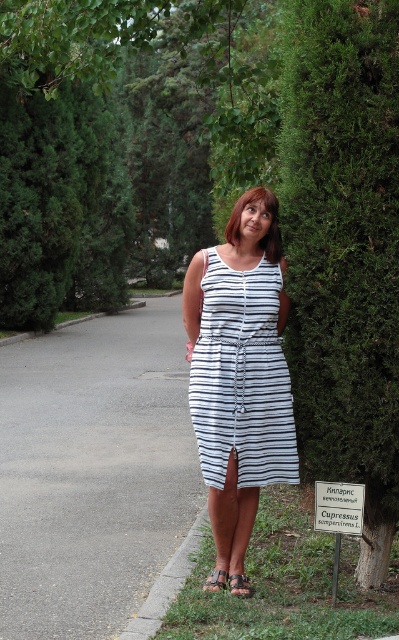
Is green textured hedge at center to the left of black leather sandal at lower center from the viewer's perspective?

No, green textured hedge at center is not to the left of black leather sandal at lower center.

Is green textured hedge at center wider than black leather sandal at lower center?

Correct, the width of green textured hedge at center exceeds that of black leather sandal at lower center.

Locate an element on the screen. The height and width of the screenshot is (640, 399). green textured hedge at center is located at coordinates (343, 250).

This screenshot has height=640, width=399. What are the coordinates of `green textured hedge at center` in the screenshot? It's located at (343, 250).

Does green textured hedge at center have a lesser height compared to gray concrete curb at lower left?

No, green textured hedge at center is not shorter than gray concrete curb at lower left.

Is point (341, 472) in front of point (136, 611)?

Yes.

This screenshot has height=640, width=399. In order to click on green textured hedge at center in this screenshot , I will do `click(343, 250)`.

Is green textured hedge at center positioned before white striped dress at center?

Yes, green textured hedge at center is closer to the viewer.

Can you confirm if green textured hedge at center is taller than white striped dress at center?

Yes, green textured hedge at center is taller than white striped dress at center.

Describe the element at coordinates (343, 250) in the screenshot. I see `green textured hedge at center` at that location.

Locate an element on the screen. This screenshot has height=640, width=399. green textured hedge at center is located at coordinates (343, 250).